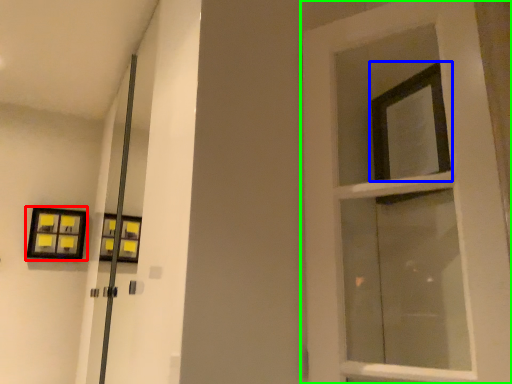
Question: Which is nearer to the picture frame (highlighted by a red box)? window (highlighted by a blue box) or door (highlighted by a green box).

Choices:
 (A) window
 (B) door

Answer: (B)